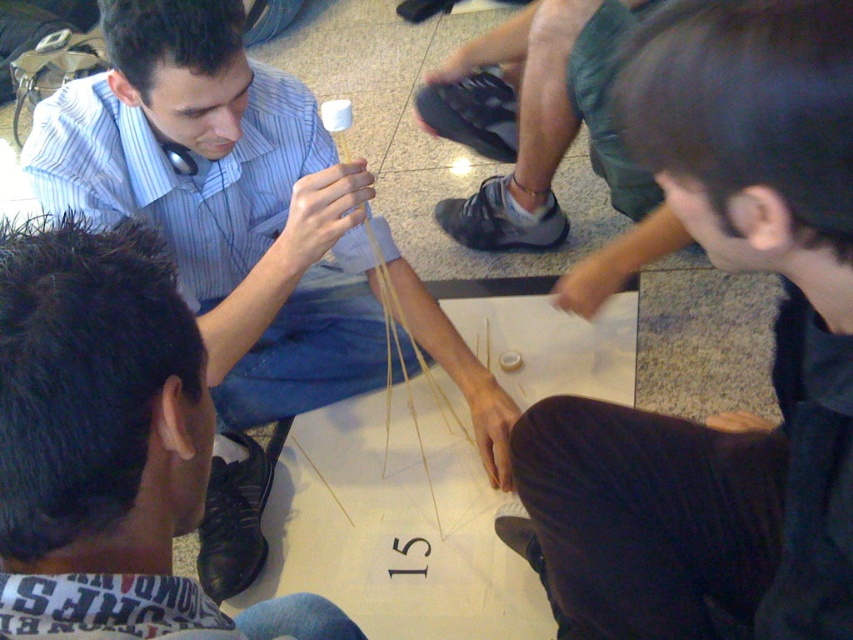
You are standing in front of the group and want to reach both the point at coordinates point (160, 35) and point (117, 292). Which point is closer to you?

Point (160, 35) is further to the camera than point (117, 292), so the closer point to you is point (117, 292).

You are a photographer trying to capture a candid shot of the group. You want to ensure both the dark brown leather jacket at lower right and the matte blue shirt at center are visible in the frame. Based on their positions, which one is closer to the bottom of the image?

The dark brown leather jacket at lower right is located below the matte blue shirt at center, so it is closer to the bottom of the image.

You are a photographer trying to capture a candid shot of the group. You want to ensure that both the dark brown leather jacket at lower right and the matte blue shirt at center are visible in the frame. Considering their sizes, which one might you need to position closer to the camera to ensure it doesn

The dark brown leather jacket at lower right is narrower than the matte blue shirt at center. To ensure both are visible, you might need to position the narrower dark brown leather jacket at lower right closer to the camera so it appears larger in the frame compared to the wider matte blue shirt at center.